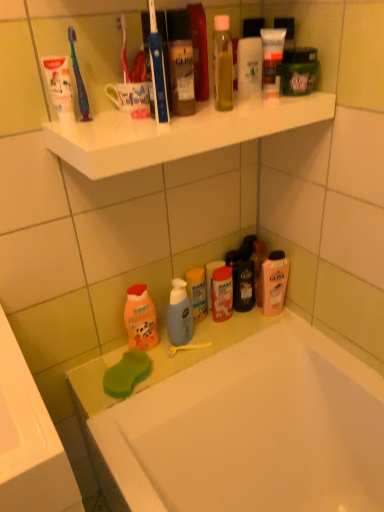
The image size is (384, 512). What are the coordinates of `vacant area that is situated to the right of blue plastic toothbrush at upper center, the 2th toothbrush from the left` in the screenshot? It's located at (226, 115).